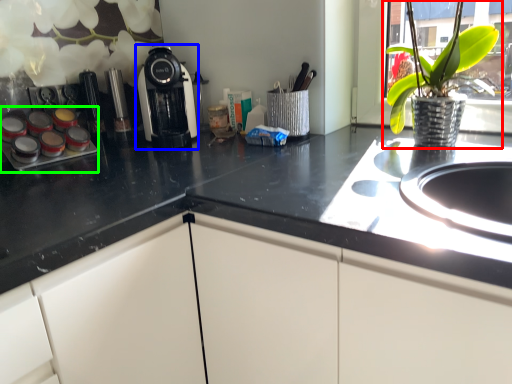
Question: Which is nearer to the houseplant (highlighted by a red box)? kitchen appliance (highlighted by a blue box) or appliance (highlighted by a green box).

Choices:
 (A) kitchen appliance
 (B) appliance

Answer: (A)